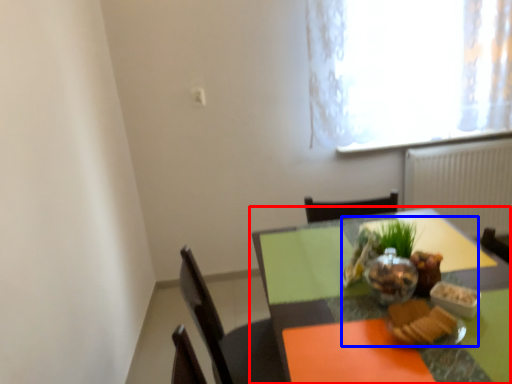
Question: Among these objects, which one is nearest to the camera, table (highlighted by a red box) or meal (highlighted by a blue box)?

Choices:
 (A) table
 (B) meal

Answer: (A)